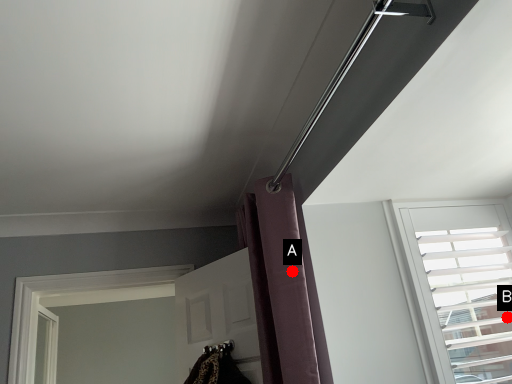
Question: Two points are circled on the image, labeled by A and B beside each circle. Which point is closer to the camera?

Choices:
 (A) A is closer
 (B) B is closer

Answer: (A)